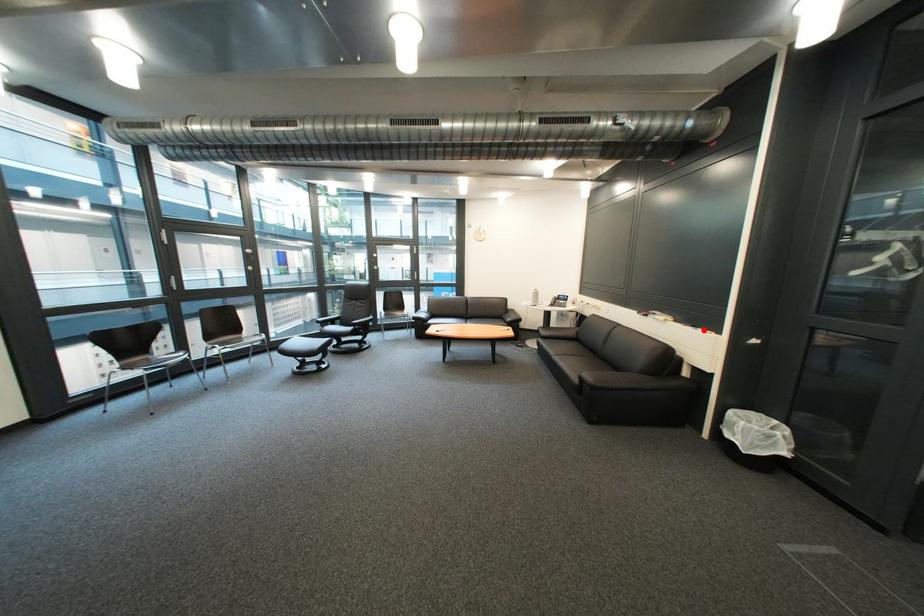
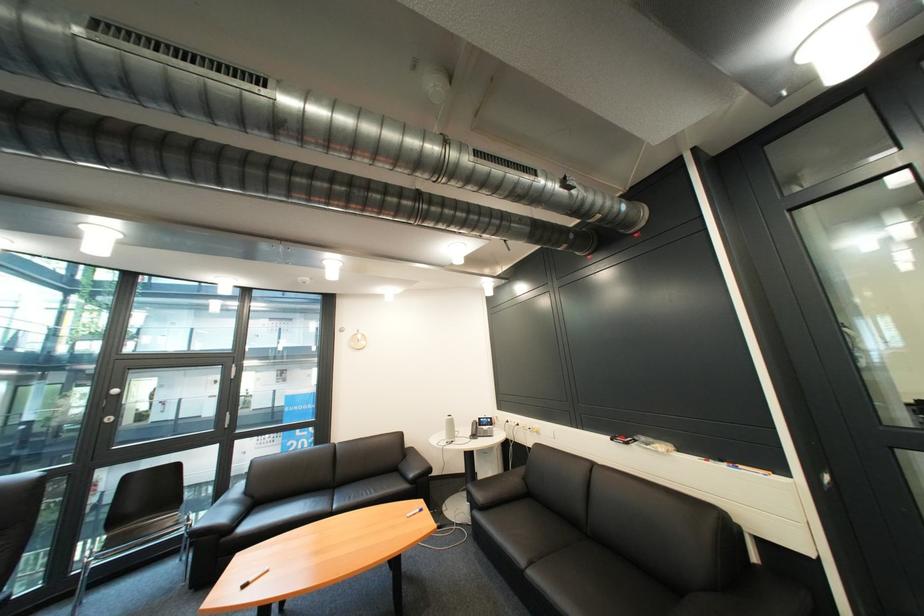
In the second image, find the point that corresponds to the highlighted location in the first image.

(736, 468)